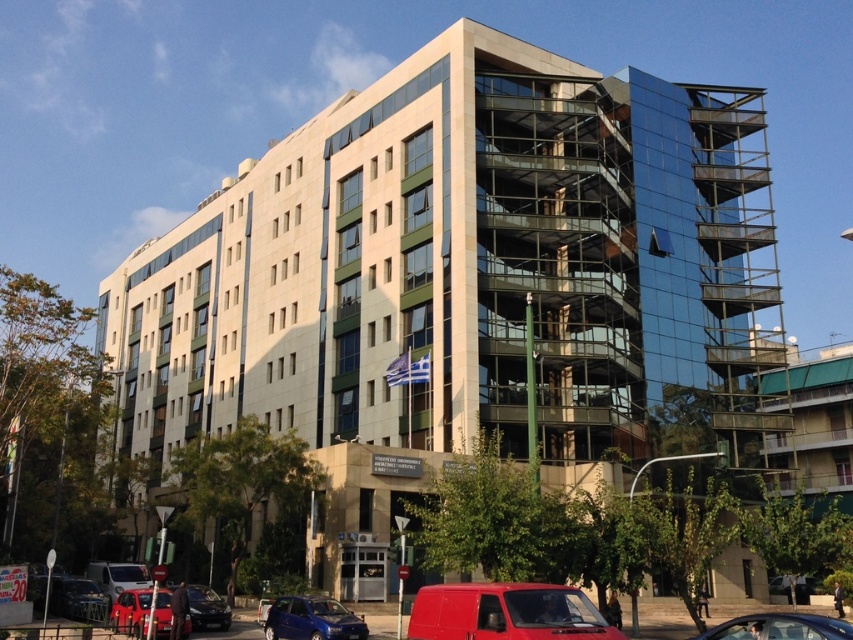
You are a delivery person arriving at this building and need to park your vehicle. You see a metallic blue suv at lower center and a shiny black sedan at lower left. Which vehicle takes up less space in the parking area?

The metallic blue suv at lower center is smaller than the shiny black sedan at lower left, so it takes up less space in the parking area.

You are a delivery driver arriving at the modern multi story building and need to park your vehicle. You see a matte red van at lower center and a metallic blue suv at lower center. Which vehicle is parked closer to the entrance?

The matte red van at lower center is closer to the viewer than the metallic blue suv at lower center, so the matte red van at lower center is parked closer to the entrance.

You are a delivery driver who needs to park your vehicle in the parking lot behind the building. You have a metallic red car at lower center and a metallic silver van at lower left. Which vehicle will require more space to park?

The metallic red car at lower center is bigger than the metallic silver van at lower left, so it will require more space to park.